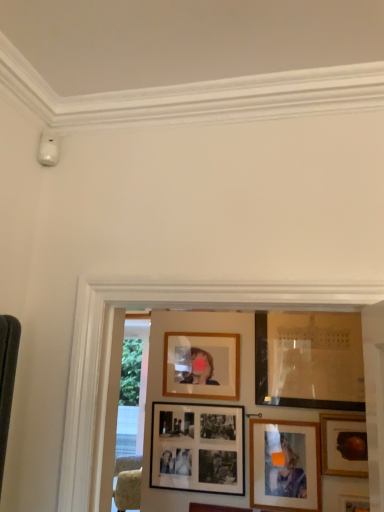
Question: From a real-world perspective, is matte glass picture frame at upper right, which is counted as the sixth picture frame, starting from the bottom, beneath wooden photo frame at lower right, which is the 6th picture frame in top-to-bottom order?

Choices:
 (A) no
 (B) yes

Answer: (A)

Question: Does matte glass picture frame at upper right, which ranks as the 1th picture frame in top-to-bottom order, appear on the left side of wooden photo frame at lower right, which is the 6th picture frame in top-to-bottom order?

Choices:
 (A) yes
 (B) no

Answer: (A)

Question: Would you say matte glass picture frame at upper right, which is counted as the sixth picture frame, starting from the bottom, contains wooden photo frame at lower right, which is the 6th picture frame in top-to-bottom order?

Choices:
 (A) no
 (B) yes

Answer: (A)

Question: Is matte glass picture frame at upper right, which ranks as the 1th picture frame in top-to-bottom order, not close to wooden photo frame at lower right, which is the 6th picture frame in top-to-bottom order?

Choices:
 (A) no
 (B) yes

Answer: (A)

Question: From a real-world perspective, is matte glass picture frame at upper right, which is counted as the sixth picture frame, starting from the bottom, positioned over wooden photo frame at lower right, which is the 6th picture frame in top-to-bottom order, based on gravity?

Choices:
 (A) no
 (B) yes

Answer: (B)

Question: Is point (344, 461) closer or farther from the camera than point (302, 507)?

Choices:
 (A) closer
 (B) farther

Answer: (B)

Question: Relative to matte wooden picture frame at lower right, which appears as the 2th picture frame when ordered from the bottom, is gold-framed painting at lower right, which appears as the third picture frame when viewed from the top, in front or behind?

Choices:
 (A) front
 (B) behind

Answer: (A)

Question: Considering the positions of gold-framed painting at lower right, which appears as the third picture frame when viewed from the top, and matte wooden picture frame at lower right, which appears as the 2th picture frame when ordered from the bottom, in the image, is gold-framed painting at lower right, which appears as the third picture frame when viewed from the top, wider or thinner than matte wooden picture frame at lower right, which appears as the 2th picture frame when ordered from the bottom,?

Choices:
 (A) wide
 (B) thin

Answer: (A)

Question: Based on their sizes in the image, would you say gold-framed painting at lower right, the 4th picture frame from the bottom, is bigger or smaller than matte wooden picture frame at lower right, which appears as the 2th picture frame when ordered from the bottom?

Choices:
 (A) big
 (B) small

Answer: (B)

Question: Do you think black matte picture frame at center, acting as the 4th picture frame starting from the top, is within gold-framed painting at lower right, the 4th picture frame from the bottom, or outside of it?

Choices:
 (A) outside
 (B) inside

Answer: (A)

Question: Looking at their shapes, would you say black matte picture frame at center, acting as the 4th picture frame starting from the top, is wider or thinner than gold-framed painting at lower right, the 4th picture frame from the bottom?

Choices:
 (A) thin
 (B) wide

Answer: (A)

Question: In the image, is black matte picture frame at center, placed as the third picture frame when sorted from bottom to top, positioned in front of or behind gold-framed painting at lower right, the 4th picture frame from the bottom?

Choices:
 (A) front
 (B) behind

Answer: (B)

Question: From a real-world perspective, relative to gold-framed painting at lower right, which appears as the third picture frame when viewed from the top, is black matte picture frame at center, placed as the third picture frame when sorted from bottom to top, vertically above or below?

Choices:
 (A) above
 (B) below

Answer: (B)

Question: Is point (354, 504) positioned closer to the camera than point (311, 473)?

Choices:
 (A) closer
 (B) farther

Answer: (A)

Question: Do you think wooden photo frame at lower right, marked as the first picture frame in a bottom-to-top arrangement, is within matte wooden picture frame at lower right, which appears as the 2th picture frame when ordered from the bottom, or outside of it?

Choices:
 (A) inside
 (B) outside

Answer: (B)